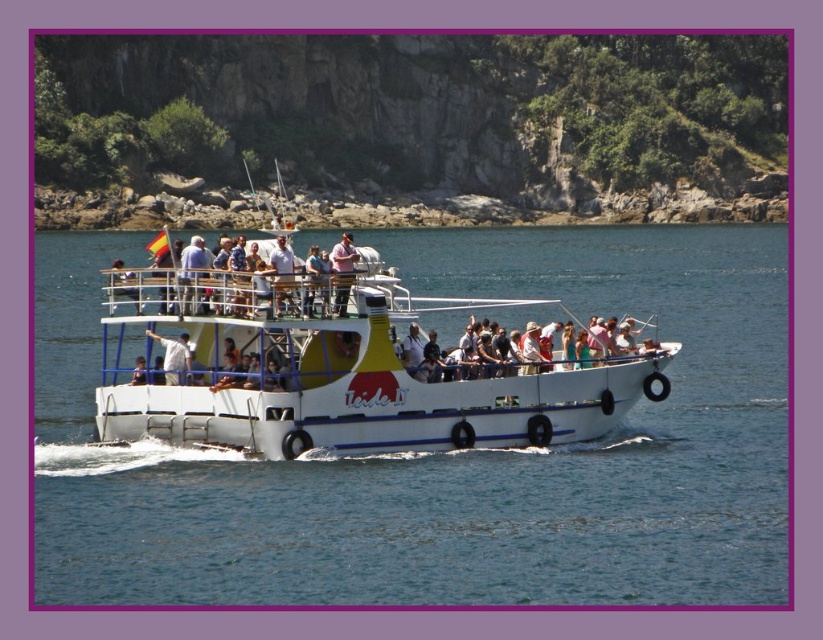
Does point (407, 400) come in front of point (611, 321)?

Yes, point (407, 400) is in front of point (611, 321).

Is point (430, 392) more distant than point (510, 364)?

That is False.

Find the location of `white matte boat at center`. white matte boat at center is located at coordinates (347, 376).

Which is more to the left, light brown wooden deck at center or white matte shirt at center?

Positioned to the left is white matte shirt at center.

Between light brown wooden deck at center and white matte shirt at center, which one has less height?

With less height is white matte shirt at center.

Locate an element on the screen. This screenshot has height=640, width=823. light brown wooden deck at center is located at coordinates (545, 349).

At what (x,y) coordinates should I click in order to perform the action: click on light brown wooden deck at center. Please return your answer as a coordinate pair (x, y). Looking at the image, I should click on (545, 349).

Does white matte boat at center have a greater width compared to pink fabric shirt at center?

Indeed, white matte boat at center has a greater width compared to pink fabric shirt at center.

Who is more distant from viewer, (305, 337) or (352, 260)?

Positioned behind is point (305, 337).

You are a GUI agent. You are given a task and a screenshot of the screen. Output one action in this format:
    pyautogui.click(x=<x>, y=<y>)
    Task: Click on the white matte boat at center
    This screenshot has height=640, width=823.
    Given the screenshot: What is the action you would take?
    pyautogui.click(x=347, y=376)